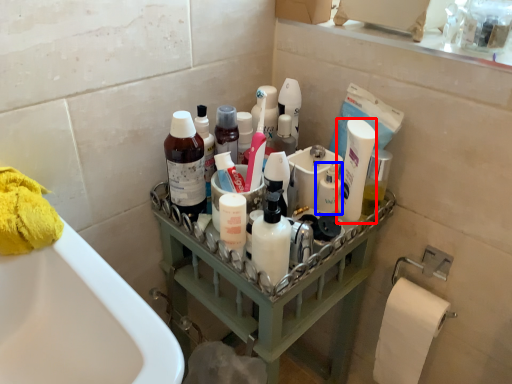
Question: Among these objects, which one is nearest to the camera, mouthwash (highlighted by a red box) or toiletry (highlighted by a blue box)?

Choices:
 (A) mouthwash
 (B) toiletry

Answer: (A)